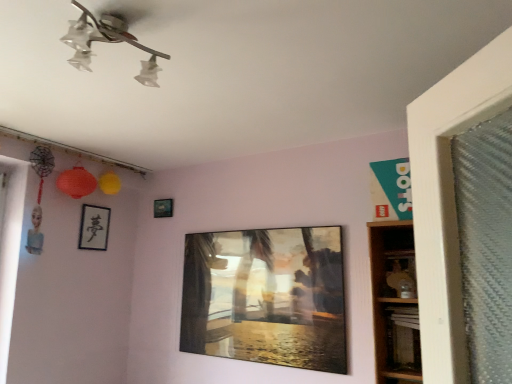
Question: Is metallic silver picture frame at upper center, placed as the 1th picture frame when sorted from back to front, to the left of metallic glass painting at center, the 3th picture frame in the left-to-right sequence, from the viewer's perspective?

Choices:
 (A) no
 (B) yes

Answer: (B)

Question: From the image's perspective, would you say metallic silver picture frame at upper center, placed as the second picture frame when sorted from right to left, is shown under metallic glass painting at center, the 3th picture frame in the left-to-right sequence?

Choices:
 (A) yes
 (B) no

Answer: (B)

Question: Is metallic silver picture frame at upper center, placed as the second picture frame when sorted from right to left, bigger than metallic glass painting at center, the 1th picture frame viewed from the right?

Choices:
 (A) yes
 (B) no

Answer: (B)

Question: Is metallic silver picture frame at upper center, placed as the 1th picture frame when sorted from back to front, located outside metallic glass painting at center, the 3th picture frame in the left-to-right sequence?

Choices:
 (A) no
 (B) yes

Answer: (B)

Question: Considering the relative sizes of metallic silver picture frame at upper center, which ranks as the third picture frame in front-to-back order, and metallic glass painting at center, the 1th picture frame viewed from the right, in the image provided, is metallic silver picture frame at upper center, which ranks as the third picture frame in front-to-back order, thinner than metallic glass painting at center, the 1th picture frame viewed from the right,?

Choices:
 (A) yes
 (B) no

Answer: (A)

Question: From a real-world perspective, is metallic silver picture frame at upper center, the 2th picture frame positioned from the left, below metallic glass painting at center, acting as the 3th picture frame starting from the back?

Choices:
 (A) no
 (B) yes

Answer: (A)

Question: Is metallic glass painting at center, acting as the 3th picture frame starting from the back, looking in the opposite direction of clear glass light fixture at upper center?

Choices:
 (A) no
 (B) yes

Answer: (A)

Question: Is the surface of metallic glass painting at center, the 1th picture frame viewed from the right, in direct contact with clear glass light fixture at upper center?

Choices:
 (A) yes
 (B) no

Answer: (B)

Question: From a real-world perspective, is metallic glass painting at center, arranged as the 1th picture frame when viewed from the front, over clear glass light fixture at upper center?

Choices:
 (A) no
 (B) yes

Answer: (A)

Question: Can you confirm if metallic glass painting at center, arranged as the 1th picture frame when viewed from the front, is taller than clear glass light fixture at upper center?

Choices:
 (A) no
 (B) yes

Answer: (B)

Question: Can you confirm if metallic glass painting at center, arranged as the 1th picture frame when viewed from the front, is shorter than clear glass light fixture at upper center?

Choices:
 (A) no
 (B) yes

Answer: (A)

Question: Does metallic glass painting at center, the 1th picture frame viewed from the right, have a lesser height compared to black matte picture frame at upper left, the 2th picture frame viewed from the back?

Choices:
 (A) no
 (B) yes

Answer: (A)